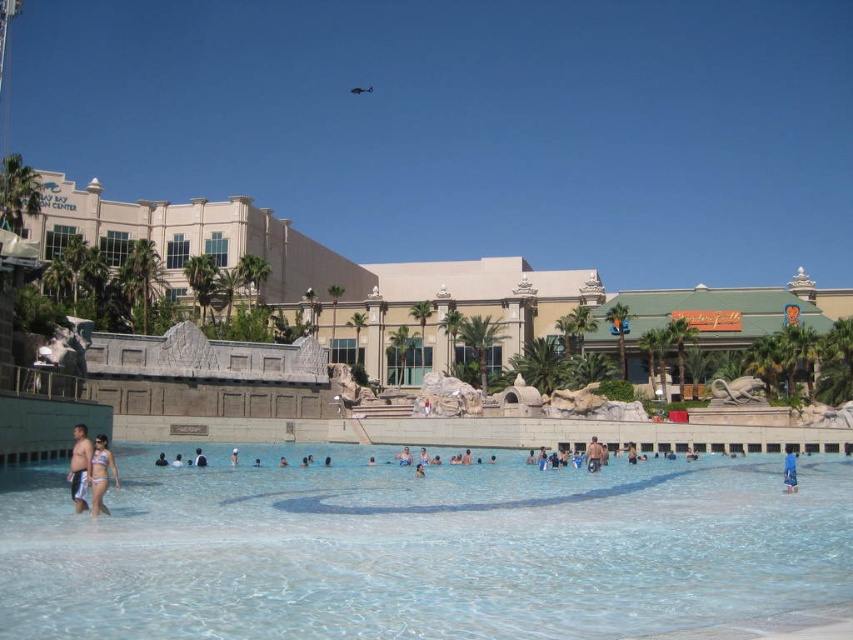
Question: Is clear glass pool at center above matte pink bikini at lower left?

Choices:
 (A) yes
 (B) no

Answer: (B)

Question: Can you confirm if matte pink bikini at lower left is positioned to the left of tan skin person at center?

Choices:
 (A) no
 (B) yes

Answer: (B)

Question: Which is farther from the tan skin person at center?

Choices:
 (A) clear glass pool at center
 (B) matte pink bikini at lower left
 (C) light blue swim trunks at left

Answer: (C)

Question: Which point is closer to the camera taking this photo?

Choices:
 (A) tap(83, 440)
 (B) tap(397, 548)
 (C) tap(589, 468)
 (D) tap(795, 467)

Answer: (B)

Question: Which of the following is the farthest from the observer?

Choices:
 (A) tan skin person at center
 (B) matte pink bikini at lower left
 (C) blue denim shorts at lower right
 (D) clear glass pool at center

Answer: (A)

Question: Can you confirm if matte pink bikini at lower left is wider than tan skin person at center?

Choices:
 (A) no
 (B) yes

Answer: (B)